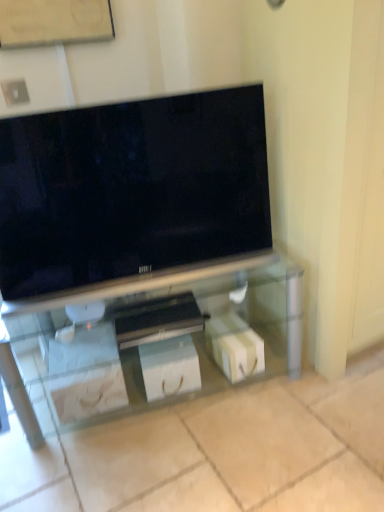
The height and width of the screenshot is (512, 384). What do you see at coordinates (132, 195) in the screenshot?
I see `matte black tv at center` at bounding box center [132, 195].

You are a GUI agent. You are given a task and a screenshot of the screen. Output one action in this format:
    pyautogui.click(x=<x>, y=<y>)
    Task: Click on the clear glass tv stand at center
    
    Given the screenshot: What is the action you would take?
    pyautogui.click(x=173, y=326)

Identify the location of matte black tv at center. The image size is (384, 512). (132, 195).

What's the angular difference between white paper bag at lower center, the first box in the left-to-right sequence, and clear glass tv stand at center's facing directions?

10.3 degrees.

This screenshot has height=512, width=384. There is a white paper bag at lower center, the first box in the left-to-right sequence. In order to click on furniture above it (from a real-world perspective) in this screenshot , I will do `click(173, 326)`.

Which is more to the right, white paper bag at lower center, the first box in the left-to-right sequence, or clear glass tv stand at center?

white paper bag at lower center, the first box in the left-to-right sequence.

Is white paper bag at lower center, the first box in the left-to-right sequence, facing away from clear glass tv stand at center?

Yes, white paper bag at lower center, the first box in the left-to-right sequence,'s orientation is away from clear glass tv stand at center.

Consider the image. Does wooden bulletin board at upper center turn towards white paper bag at lower center, the first box in the left-to-right sequence?

No, wooden bulletin board at upper center does not turn towards white paper bag at lower center, the first box in the left-to-right sequence.

Considering the sizes of objects wooden bulletin board at upper center and white paper bag at lower center, arranged as the 2th box when viewed from the right, in the image provided, who is bigger, wooden bulletin board at upper center or white paper bag at lower center, arranged as the 2th box when viewed from the right,?

white paper bag at lower center, arranged as the 2th box when viewed from the right, is bigger.

Consider the image. Between wooden bulletin board at upper center and white paper bag at lower center, the first box in the left-to-right sequence, which one has smaller width?

wooden bulletin board at upper center is thinner.

From the image's perspective, is wooden bulletin board at upper center located beneath white paper bag at lower center, arranged as the 2th box when viewed from the right?

Actually, wooden bulletin board at upper center appears above white paper bag at lower center, arranged as the 2th box when viewed from the right, in the image.

Does point (54, 382) lie behind point (150, 394)?

No, it is not.

Can you confirm if clear glass tv stand at center is wider than white paper bag at lower center, arranged as the 2th box when viewed from the right?

Correct, the width of clear glass tv stand at center exceeds that of white paper bag at lower center, arranged as the 2th box when viewed from the right.

Is clear glass tv stand at center bigger or smaller than white paper bag at lower center, the first box in the left-to-right sequence?

clear glass tv stand at center is bigger than white paper bag at lower center, the first box in the left-to-right sequence.

From a real-world perspective, which object rests below the other?

white glossy box at center, which ranks as the 2th box in left-to-right order, from a real-world perspective.

From the image's perspective, is white glossy box at center, which ranks as the 2th box in left-to-right order, positioned above or below matte black tv at center?

white glossy box at center, which ranks as the 2th box in left-to-right order, is below matte black tv at center.

Which is more to the left, white glossy box at center, which ranks as the 2th box in left-to-right order, or matte black tv at center?

matte black tv at center.

You are a GUI agent. You are given a task and a screenshot of the screen. Output one action in this format:
    pyautogui.click(x=<x>, y=<y>)
    Task: Click on the television that appears above the white glossy box at center, the first box in the right-to-left sequence (from the image's perspective)
    
    Given the screenshot: What is the action you would take?
    pyautogui.click(x=132, y=195)

Who is more distant, wooden bulletin board at upper center or matte black tv at center?

wooden bulletin board at upper center is more distant.

Is wooden bulletin board at upper center oriented away from matte black tv at center?

No.

From a real-world perspective, is wooden bulletin board at upper center on top of matte black tv at center?

Yes, from a real-world perspective, wooden bulletin board at upper center is on top of matte black tv at center.

Is point (47, 16) farther from camera compared to point (9, 123)?

Yes, it is behind point (9, 123).

Identify the location of box that is the 2nd object directly below the matte black tv at center (from a real-world perspective). [234, 346].

Is matte black tv at center to the right of white glossy box at center, which ranks as the 2th box in left-to-right order, from the viewer's perspective?

Incorrect, matte black tv at center is not on the right side of white glossy box at center, which ranks as the 2th box in left-to-right order.

What's the angular difference between matte black tv at center and white glossy box at center, which ranks as the 2th box in left-to-right order,'s facing directions?

The angular difference between matte black tv at center and white glossy box at center, which ranks as the 2th box in left-to-right order, is 4.05 degrees.

Is white glossy box at center, which ranks as the 2th box in left-to-right order, looking in the opposite direction of wooden bulletin board at upper center?

No, white glossy box at center, which ranks as the 2th box in left-to-right order, is not facing away from wooden bulletin board at upper center.

The width and height of the screenshot is (384, 512). In order to click on bulletin board on the left of white glossy box at center, the first box in the right-to-left sequence in this screenshot , I will do `click(54, 22)`.

Measure the distance between white glossy box at center, the first box in the right-to-left sequence, and wooden bulletin board at upper center.

1.40 meters.

Considering the relative sizes of white glossy box at center, which ranks as the 2th box in left-to-right order, and wooden bulletin board at upper center in the image provided, is white glossy box at center, which ranks as the 2th box in left-to-right order, taller than wooden bulletin board at upper center?

Yes.

Identify the location of the 1st box below the clear glass tv stand at center (from a real-world perspective). This screenshot has width=384, height=512. (170, 367).

The width and height of the screenshot is (384, 512). I want to click on bulletin board in front of the white paper bag at lower center, the first box in the left-to-right sequence, so click(54, 22).

Which object lies further to the anchor point wooden bulletin board at upper center, white glossy box at center, which ranks as the 2th box in left-to-right order, or clear glass tv stand at center?

Based on the image, white glossy box at center, which ranks as the 2th box in left-to-right order, appears to be further to wooden bulletin board at upper center.

In the scene shown: Estimate the real-world distances between objects in this image. Which object is further from matte black tv at center, white paper bag at lower center, the first box in the left-to-right sequence, or clear glass tv stand at center?

The object further to matte black tv at center is white paper bag at lower center, the first box in the left-to-right sequence.

When comparing their distances from white glossy box at center, the first box in the right-to-left sequence, does wooden bulletin board at upper center or white paper bag at lower center, the first box in the left-to-right sequence, seem further?

wooden bulletin board at upper center is further to white glossy box at center, the first box in the right-to-left sequence.

Looking at the image, which one is located closer to clear glass tv stand at center, white paper bag at lower center, arranged as the 2th box when viewed from the right, or matte black tv at center?

white paper bag at lower center, arranged as the 2th box when viewed from the right, lies closer to clear glass tv stand at center than the other object.

When comparing their distances from white paper bag at lower center, arranged as the 2th box when viewed from the right, does wooden bulletin board at upper center or clear glass tv stand at center seem closer?

clear glass tv stand at center is closer to white paper bag at lower center, arranged as the 2th box when viewed from the right.

Considering their positions, is clear glass tv stand at center positioned further to matte black tv at center than white paper bag at lower center, arranged as the 2th box when viewed from the right?

Among the two, white paper bag at lower center, arranged as the 2th box when viewed from the right, is located further to matte black tv at center.

When comparing their distances from clear glass tv stand at center, does white paper bag at lower center, the first box in the left-to-right sequence, or white glossy box at center, the first box in the right-to-left sequence, seem further?

white glossy box at center, the first box in the right-to-left sequence.

Estimate the real-world distances between objects in this image. Which object is further from wooden bulletin board at upper center, clear glass tv stand at center or white glossy box at center, the first box in the right-to-left sequence?

white glossy box at center, the first box in the right-to-left sequence, is positioned further to the anchor wooden bulletin board at upper center.

Identify the location of box between matte black tv at center and white paper bag at lower center, arranged as the 2th box when viewed from the right, from top to bottom. (234, 346).

Find the location of a particular element. box located between clear glass tv stand at center and white glossy box at center, which ranks as the 2th box in left-to-right order, in the depth direction is located at coordinates (170, 367).

Identify the location of television between wooden bulletin board at upper center and clear glass tv stand at center in the up-down direction. The height and width of the screenshot is (512, 384). (132, 195).

Image resolution: width=384 pixels, height=512 pixels. Find the location of `furniture between matte black tv at center and white paper bag at lower center, arranged as the 2th box when viewed from the right, in the up-down direction`. furniture between matte black tv at center and white paper bag at lower center, arranged as the 2th box when viewed from the right, in the up-down direction is located at coordinates (173, 326).